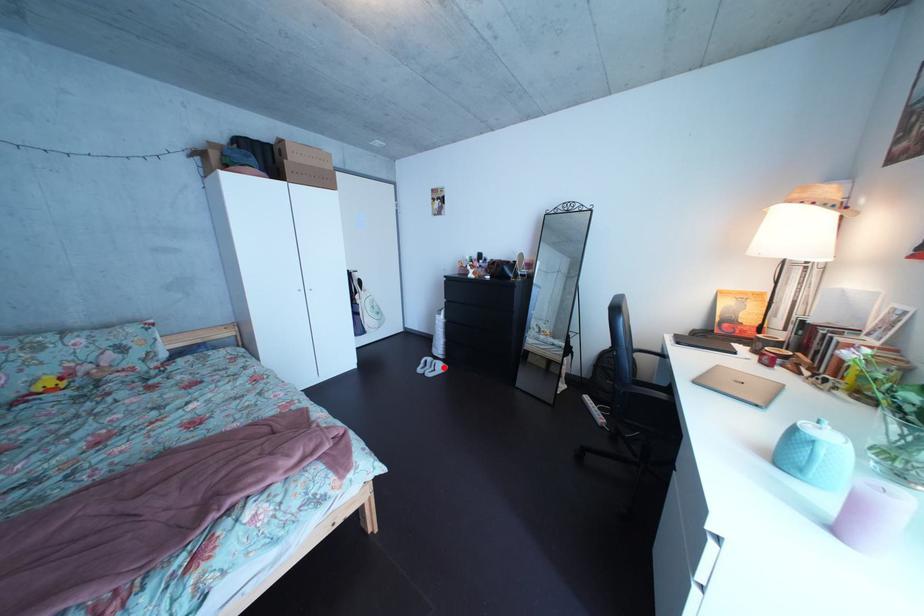
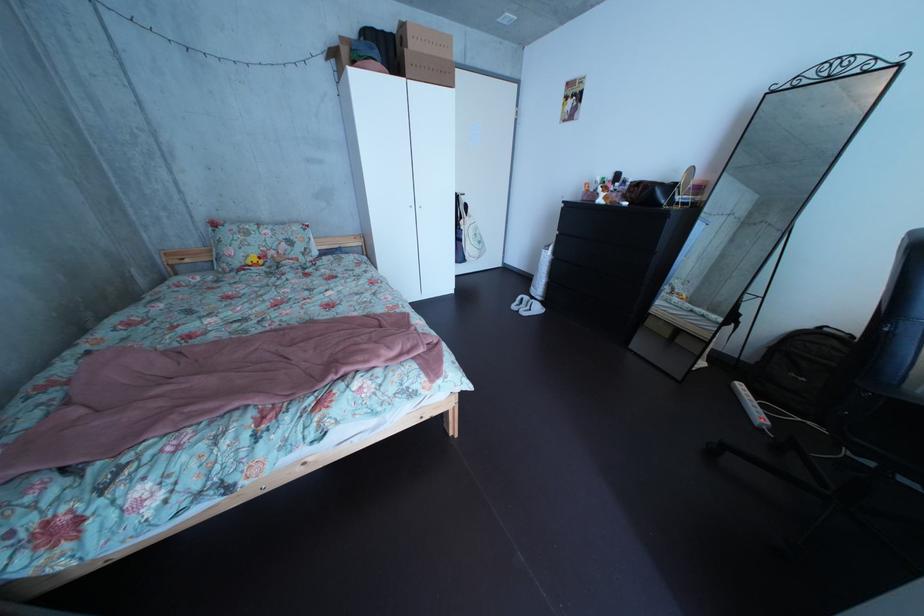
Find the pixel in the second image that matches the highlighted location in the first image.

(541, 306)